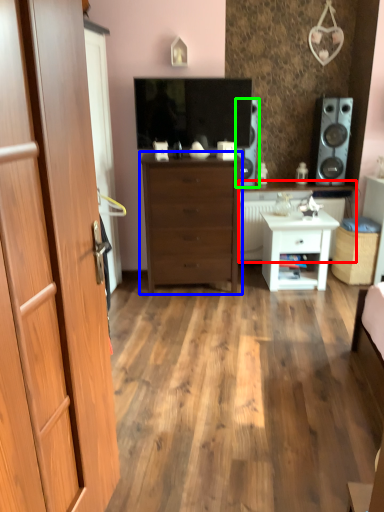
Question: Which is nearer to the counter top (highlighted by a red box)? chest of drawers (highlighted by a blue box) or speaker (highlighted by a green box).

Choices:
 (A) chest of drawers
 (B) speaker

Answer: (B)